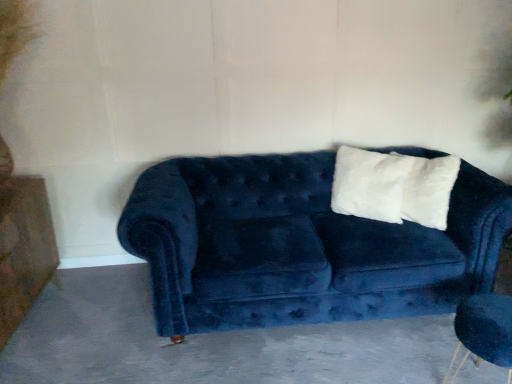
Identify the location of velvet blue couch at center. The height and width of the screenshot is (384, 512). (300, 245).

You are a GUI agent. You are given a task and a screenshot of the screen. Output one action in this format:
    pyautogui.click(x=<x>, y=<y>)
    Task: Click on the dark gray concrete at center
    
    Given the screenshot: What is the action you would take?
    pyautogui.click(x=206, y=342)

What is the approximate width of velvet blue armchair at lower right?

The width of velvet blue armchair at lower right is 13.82 inches.

This screenshot has height=384, width=512. Describe the element at coordinates (483, 332) in the screenshot. I see `velvet blue armchair at lower right` at that location.

Image resolution: width=512 pixels, height=384 pixels. I want to click on velvet blue couch at center, so click(300, 245).

Considering the sizes of velvet blue couch at center and velvet blue armchair at lower right in the image, is velvet blue couch at center wider or thinner than velvet blue armchair at lower right?

Clearly, velvet blue couch at center has more width compared to velvet blue armchair at lower right.

From a real-world perspective, who is located lower, velvet blue couch at center or velvet blue armchair at lower right?

velvet blue armchair at lower right, from a real-world perspective.

Does velvet blue couch at center have a larger size compared to velvet blue armchair at lower right?

Indeed, velvet blue couch at center has a larger size compared to velvet blue armchair at lower right.

Can we say velvet blue couch at center lies outside velvet blue armchair at lower right?

Yes, velvet blue couch at center is outside of velvet blue armchair at lower right.

Could you tell me if velvet blue armchair at lower right is turned towards white fluffy pillow at upper right?

No, velvet blue armchair at lower right is not aimed at white fluffy pillow at upper right.

Is velvet blue armchair at lower right wider or thinner than white fluffy pillow at upper right?

velvet blue armchair at lower right is wider than white fluffy pillow at upper right.

Locate an element on the screen. armchair to the right of white fluffy pillow at upper right is located at coordinates (483, 332).

From a real-world perspective, which object rests below the other?

From a 3D spatial view, velvet blue armchair at lower right is below.

Which is closer to the camera, (418, 203) or (511, 369)?

Point (418, 203) appears to be farther away from the viewer than point (511, 369).

Is white fluffy pillow at upper right facing towards velvet blue armchair at lower right?

No, white fluffy pillow at upper right is not turned towards velvet blue armchair at lower right.

Looking at this image, considering the relative sizes of white fluffy pillow at upper right and velvet blue armchair at lower right in the image provided, is white fluffy pillow at upper right bigger than velvet blue armchair at lower right?

No, white fluffy pillow at upper right is not bigger than velvet blue armchair at lower right.

What's the angular difference between white fluffy pillow at upper right and dark gray concrete at center's facing directions?

The angular difference between white fluffy pillow at upper right and dark gray concrete at center is 153 degrees.

Could you tell me if white fluffy pillow at upper right is facing dark gray concrete at center?

No, white fluffy pillow at upper right does not turn towards dark gray concrete at center.

Is point (417, 176) positioned after point (211, 365)?

Yes, point (417, 176) is behind point (211, 365).

Which object is further away from the camera taking this photo, white fluffy pillow at upper right or dark gray concrete at center?

white fluffy pillow at upper right is more distant.

From the image's perspective, who appears lower, velvet blue armchair at lower right or dark gray concrete at center?

dark gray concrete at center is shown below in the image.

How much distance is there between velvet blue armchair at lower right and dark gray concrete at center?

They are 30.82 inches apart.

Which object is further away from the camera, velvet blue armchair at lower right or dark gray concrete at center?

dark gray concrete at center is further from the camera.

From a real-world perspective, who is located higher, velvet blue armchair at lower right or dark gray concrete at center?

velvet blue armchair at lower right is physically above.

Find the location of `armchair that is in front of the dark gray concrete at center`. armchair that is in front of the dark gray concrete at center is located at coordinates (483, 332).

From a real-world perspective, is dark gray concrete at center above or below velvet blue armchair at lower right?

From a real-world perspective, dark gray concrete at center is physically below velvet blue armchair at lower right.

Is dark gray concrete at center looking in the opposite direction of velvet blue armchair at lower right?

No, dark gray concrete at center is not facing the opposite direction of velvet blue armchair at lower right.

From their relative heights in the image, would you say dark gray concrete at center is taller or shorter than velvet blue armchair at lower right?

Clearly, dark gray concrete at center is shorter compared to velvet blue armchair at lower right.

Is white fluffy pillow at upper right looking in the opposite direction of velvet blue couch at center?

Absolutely, white fluffy pillow at upper right is directed away from velvet blue couch at center.

Considering the sizes of white fluffy pillow at upper right and velvet blue couch at center in the image, is white fluffy pillow at upper right taller or shorter than velvet blue couch at center?

Considering their sizes, white fluffy pillow at upper right has less height than velvet blue couch at center.

Is white fluffy pillow at upper right further to camera compared to velvet blue couch at center?

That is True.

Considering the sizes of white fluffy pillow at upper right and velvet blue couch at center in the image, is white fluffy pillow at upper right bigger or smaller than velvet blue couch at center?

Considering their sizes, white fluffy pillow at upper right takes up less space than velvet blue couch at center.

The width and height of the screenshot is (512, 384). I want to click on studio couch above the velvet blue armchair at lower right (from the image's perspective), so click(300, 245).

Locate an element on the screen. The image size is (512, 384). pillow above the velvet blue armchair at lower right (from a real-world perspective) is located at coordinates (429, 190).

Looking at the image, which one is located further to velvet blue armchair at lower right, velvet blue couch at center or white fluffy pillow at upper right?

velvet blue couch at center.

Based on their spatial positions, is white fluffy pillow at upper right or velvet blue couch at center closer to dark gray concrete at center?

Among the two, velvet blue couch at center is located nearer to dark gray concrete at center.

When comparing their distances from white fluffy pillow at upper right, does velvet blue couch at center or dark gray concrete at center seem closer?

velvet blue couch at center is closer to white fluffy pillow at upper right.

Estimate the real-world distances between objects in this image. Which object is further from velvet blue armchair at lower right, white fluffy pillow at upper right or dark gray concrete at center?

Among the two, dark gray concrete at center is located further to velvet blue armchair at lower right.

Which object lies nearer to the anchor point dark gray concrete at center, velvet blue armchair at lower right or velvet blue couch at center?

The object closer to dark gray concrete at center is velvet blue couch at center.

Based on the photo, based on their spatial positions, is dark gray concrete at center or velvet blue couch at center further from white fluffy pillow at upper right?

dark gray concrete at center.

Considering their positions, is velvet blue armchair at lower right positioned further to white fluffy pillow at upper right than dark gray concrete at center?

The object further to white fluffy pillow at upper right is dark gray concrete at center.

Estimate the real-world distances between objects in this image. Which object is further from velvet blue couch at center, velvet blue armchair at lower right or white fluffy pillow at upper right?

Based on the image, velvet blue armchair at lower right appears to be further to velvet blue couch at center.

Where is `studio couch between white fluffy pillow at upper right and dark gray concrete at center vertically`? studio couch between white fluffy pillow at upper right and dark gray concrete at center vertically is located at coordinates (300, 245).

What are the coordinates of `pillow between velvet blue couch at center and velvet blue armchair at lower right in the horizontal direction` in the screenshot? It's located at (429, 190).

Identify the location of armchair between white fluffy pillow at upper right and dark gray concrete at center from top to bottom. (483, 332).

You are a GUI agent. You are given a task and a screenshot of the screen. Output one action in this format:
    pyautogui.click(x=<x>, y=<y>)
    Task: Click on the concrete located between velvet blue couch at center and velvet blue armchair at lower right in the left-right direction
    This screenshot has width=512, height=384.
    Given the screenshot: What is the action you would take?
    pyautogui.click(x=206, y=342)